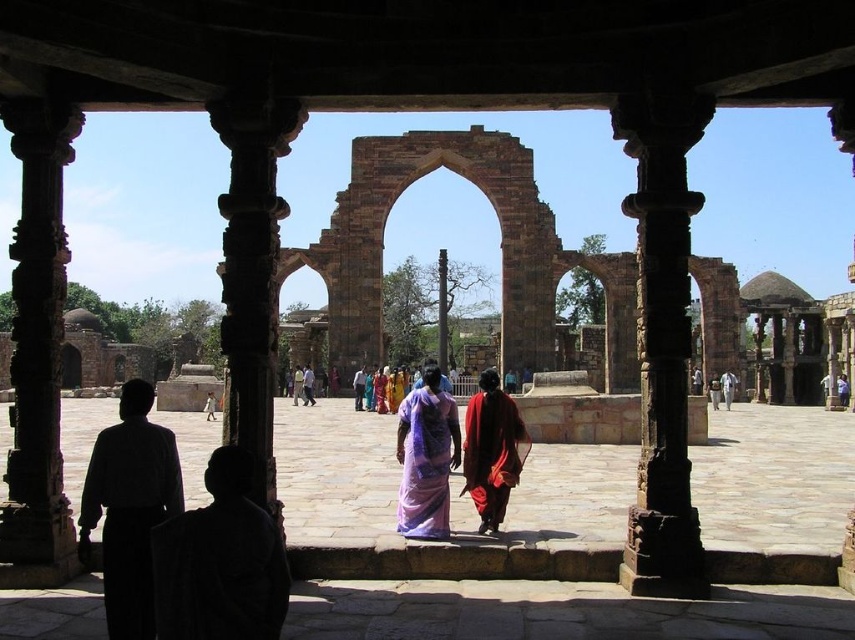
In the scene shown: Does matte purple sari at center appear on the left side of white cotton dress at center?

Incorrect, matte purple sari at center is not on the left side of white cotton dress at center.

Is point (728, 401) closer to camera compared to point (209, 410)?

No, it is behind (209, 410).

Measure the distance between matte purple sari at center and camera.

matte purple sari at center and camera are 442.64 feet apart from each other.

The height and width of the screenshot is (640, 855). Find the location of `matte purple sari at center`. matte purple sari at center is located at coordinates (727, 387).

Is point (433, 518) positioned after point (205, 416)?

No, (433, 518) is in front of (205, 416).

Who is more distant from viewer, (x=416, y=394) or (x=205, y=404)?

The point (x=205, y=404) is more distant.

You are a GUI agent. You are given a task and a screenshot of the screen. Output one action in this format:
    pyautogui.click(x=<x>, y=<y>)
    Task: Click on the purple silk saree at center
    The width and height of the screenshot is (855, 640).
    Given the screenshot: What is the action you would take?
    pyautogui.click(x=426, y=461)

Between point (653, 413) and point (209, 419), which one is positioned in front?

Point (653, 413) is more forward.

Does brown stone pillar at center appear on the right side of white cotton dress at center?

Indeed, brown stone pillar at center is positioned on the right side of white cotton dress at center.

Does point (657, 360) come farther from viewer compared to point (211, 403)?

No, it is in front of (211, 403).

Image resolution: width=855 pixels, height=640 pixels. Identify the location of brown stone pillar at center. (662, 337).